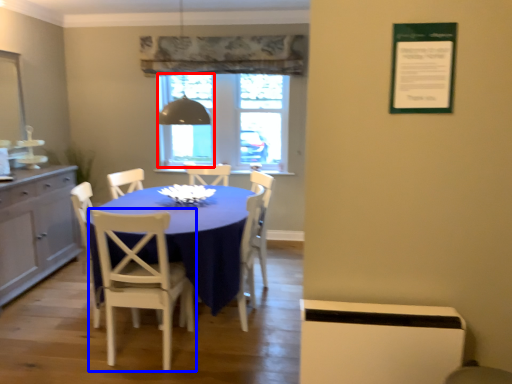
Question: Among these objects, which one is nearest to the camera, window screen (highlighted by a red box) or chair (highlighted by a blue box)?

Choices:
 (A) window screen
 (B) chair

Answer: (B)